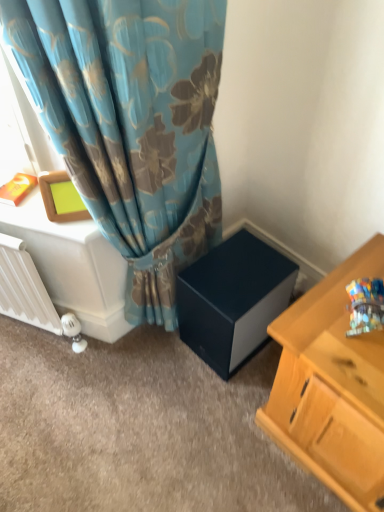
Question: In terms of size, does white glossy table at left appear bigger or smaller than matte black cube at center?

Choices:
 (A) small
 (B) big

Answer: (B)

Question: Is white glossy table at left situated inside matte black cube at center or outside?

Choices:
 (A) inside
 (B) outside

Answer: (B)

Question: Based on their relative distances, which object is farther from the white matte radiator at lower left?

Choices:
 (A) white glossy table at left
 (B) matte black cube at center

Answer: (B)

Question: Which object is the closest to the matte black cube at center?

Choices:
 (A) white glossy table at left
 (B) white matte radiator at lower left

Answer: (A)